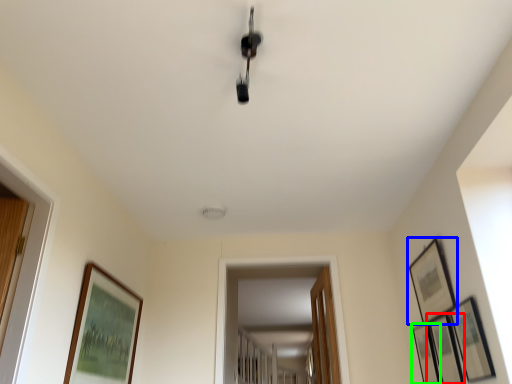
Question: Which object is the closest to the picture frame (highlighted by a red box)? Choose among these: picture frame (highlighted by a blue box) or picture frame (highlighted by a green box).

Choices:
 (A) picture frame
 (B) picture frame

Answer: (B)